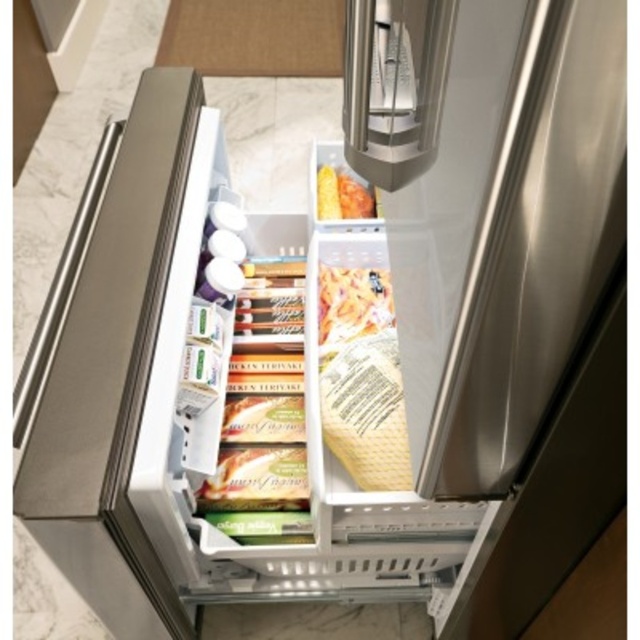
You are a delivery person who just received a package that is 30 inches long. You need to place it in the refrigerator drawer shown. Can the package fit inside the refrigerator drawer if you place it along the length of the translucent plastic bag of pasta at center?

The distance between the translucent plastic bag of pasta at center and the viewer is 31.13 inches. Since the package is 30 inches long, it can fit inside the refrigerator drawer when placed along the length of the translucent plastic bag of pasta at center because 30 inches is shorter than 31.13 inches.

You are organizing groceries in your fridge and see the point at coordinate (x=362, y=378). What item is this point located on?

The point at coordinate (x=362, y=378) is located on the translucent plastic bag of pasta at center.

You are organizing your fridge and need to place a new container of yogurt. The container has a height of 10 cm. The yogurt container must be placed in the refrigerator drawer such that it doesn not block the view of the translucent plastic bag of pasta at center. Based on the drawer layout described, where should you place the yogurt container?

The yogurt container should be placed on the left side of the drawer where the yogurt containers are already stored, as the translucent plastic bag of pasta at center is located at the center point and placing the yogurt on the left will keep it out of the way while maintaining visibility to the pasta.